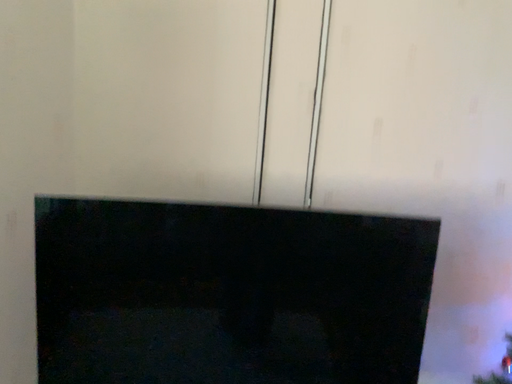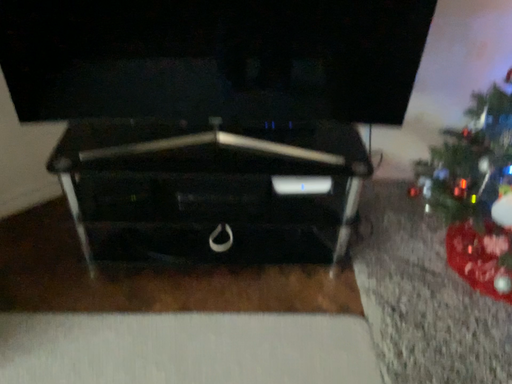
Question: How did the camera likely rotate when shooting the video?

Choices:
 (A) rotated upward
 (B) rotated downward

Answer: (B)